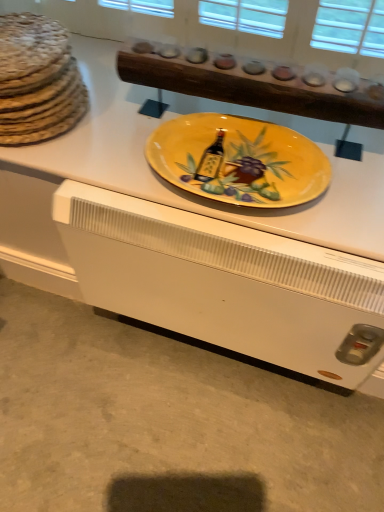
At what (x,y) coordinates should I click in order to perform the action: click on vacant area situated to the left side of yellow ceramic plate at center. Please return your answer as a coordinate pair (x, y). This screenshot has width=384, height=512. Looking at the image, I should click on (99, 140).